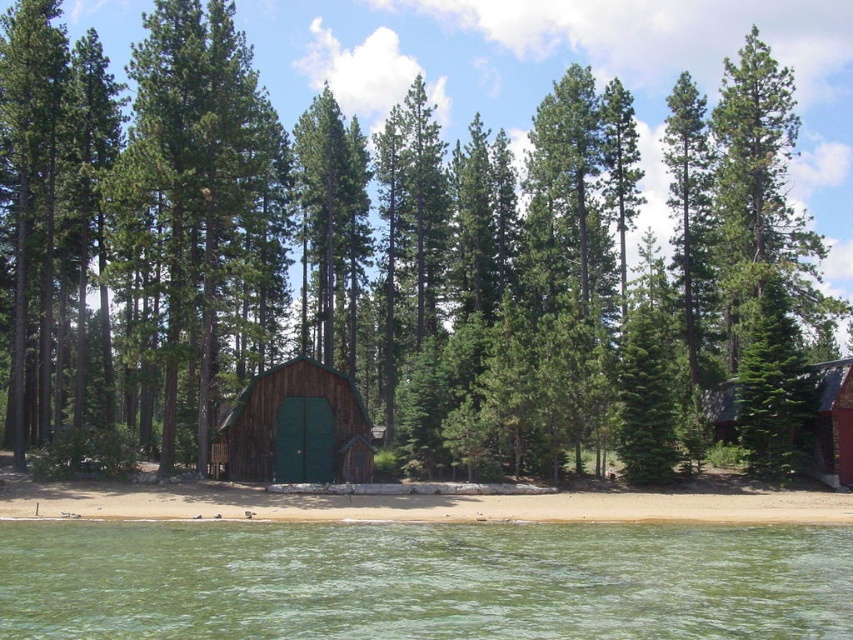
You are standing at the edge of the sandy shore at lower center and want to reach the red brick cabin at right. Which direction should you move to get closer to the cabin?

Since the sandy shore at lower center is lower in height compared to the red brick cabin at right, you should move upward towards the cabin.